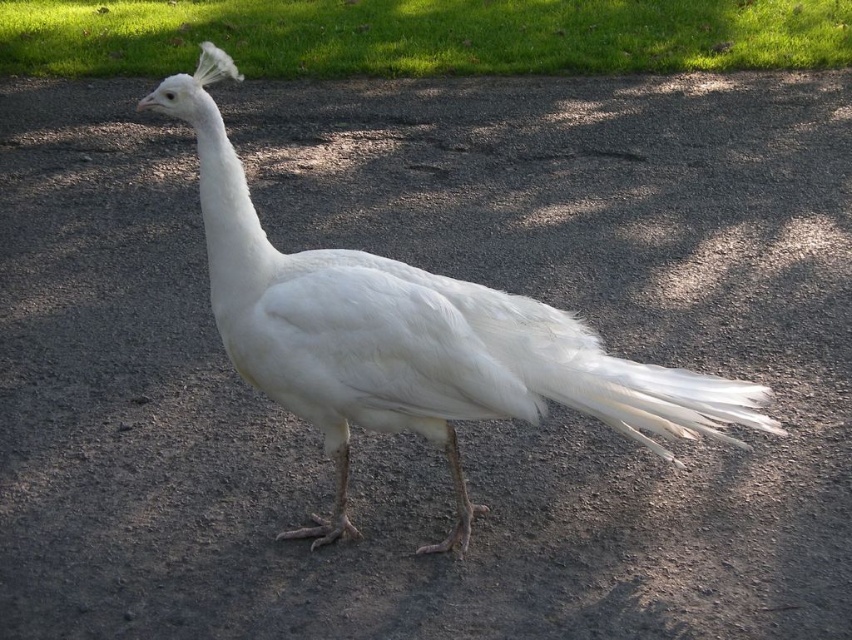
Consider the image. Does white feathered peacock at center have a greater width compared to white feathered tail at right?

Correct, the width of white feathered peacock at center exceeds that of white feathered tail at right.

The height and width of the screenshot is (640, 852). What do you see at coordinates (409, 337) in the screenshot?
I see `white feathered peacock at center` at bounding box center [409, 337].

Between point (268, 275) and point (580, 365), which one is positioned in front?

Positioned in front is point (268, 275).

Where is `white feathered peacock at center`? The image size is (852, 640). white feathered peacock at center is located at coordinates (409, 337).

Who is more distant from viewer, (583, 394) or (376, 40)?

The point (376, 40) is more distant.

Who is positioned more to the left, white feathered peacock at center or green grass at upper center?

green grass at upper center

I want to click on white feathered peacock at center, so click(409, 337).

Is point (377, 48) closer to viewer compared to point (684, 433)?

That is False.

Locate an element on the screen. The width and height of the screenshot is (852, 640). green grass at upper center is located at coordinates (421, 35).

Locate an element on the screen. Image resolution: width=852 pixels, height=640 pixels. green grass at upper center is located at coordinates pyautogui.click(x=421, y=35).